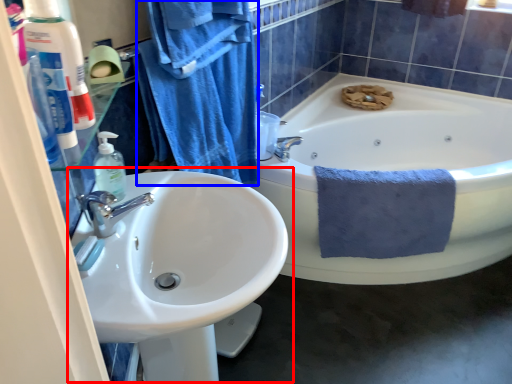
Question: Among these objects, which one is farthest to the camera, sink (highlighted by a red box) or bath towel (highlighted by a blue box)?

Choices:
 (A) sink
 (B) bath towel

Answer: (B)